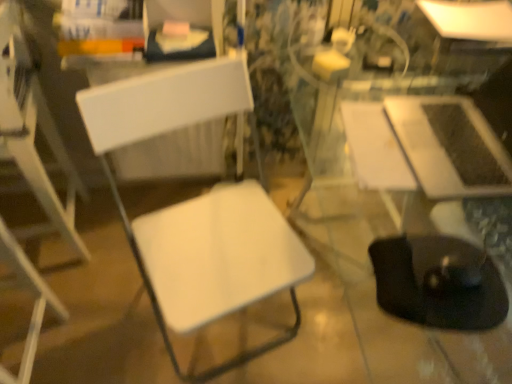
I want to click on free space below satin silver laptop at right, which appears as the second table when viewed from the back (from a real-world perspective), so click(463, 152).